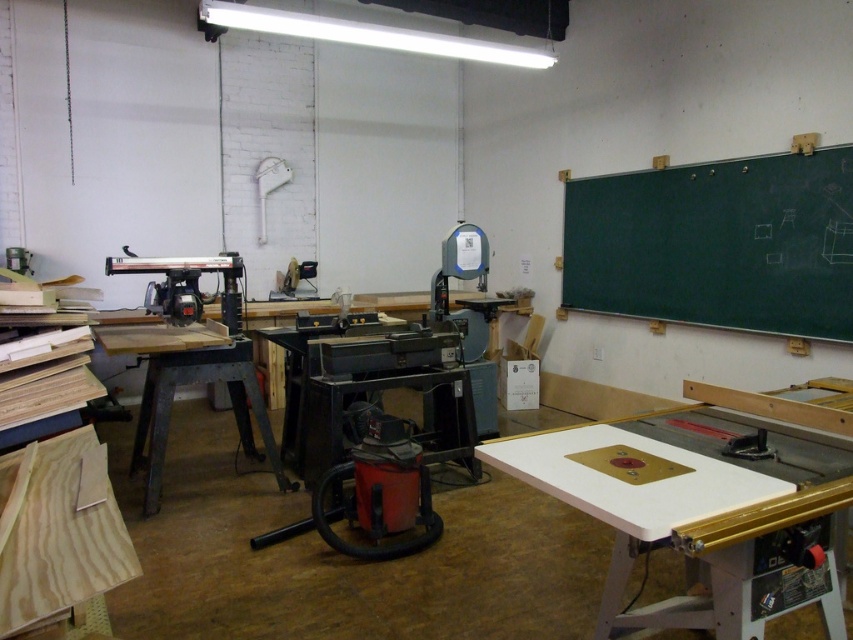
Is the position of green chalkboard at upper right less distant than that of metallic gray workbench at center?

No, green chalkboard at upper right is further to the viewer.

Is green chalkboard at upper right bigger than metallic gray workbench at center?

Yes.

Which is in front, point (838, 326) or point (186, 333)?

Positioned in front is point (186, 333).

I want to click on green chalkboard at upper right, so click(x=717, y=243).

From the picture: Between white glossy table at center and metallic gray workbench at center, which one appears on the left side from the viewer's perspective?

Positioned to the left is metallic gray workbench at center.

Is point (782, 476) positioned behind point (254, 396)?

No, it is not.

The height and width of the screenshot is (640, 853). What are the coordinates of `white glossy table at center` in the screenshot? It's located at (694, 509).

Which is in front, point (762, 513) or point (776, 202)?

Positioned in front is point (762, 513).

Between white glossy table at center and green chalkboard at upper right, which one appears on the left side from the viewer's perspective?

white glossy table at center is more to the left.

Which is in front, point (683, 616) or point (834, 244)?

Point (683, 616)

Locate an element on the screen. This screenshot has width=853, height=640. white glossy table at center is located at coordinates (694, 509).